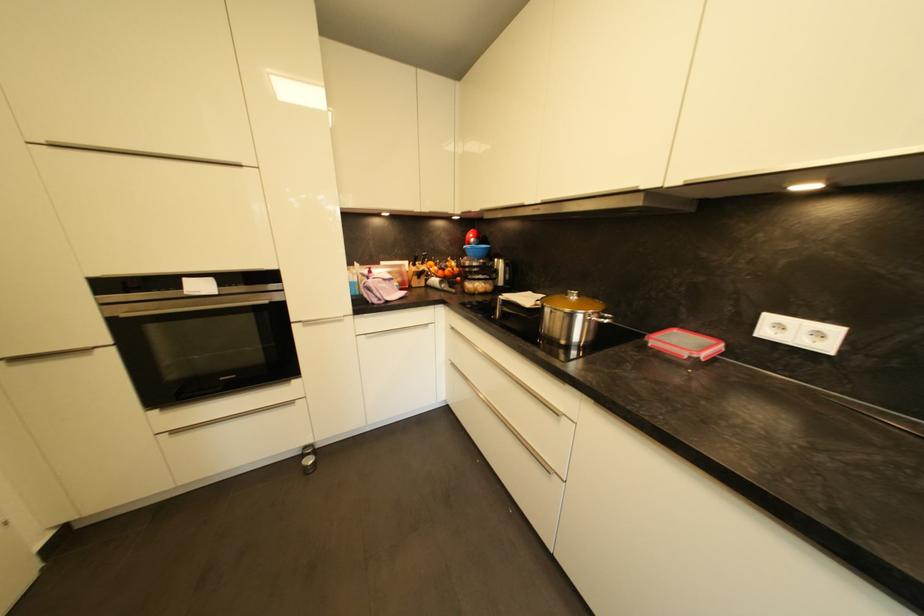
In order to click on red food container in this screenshot , I will do `click(685, 344)`.